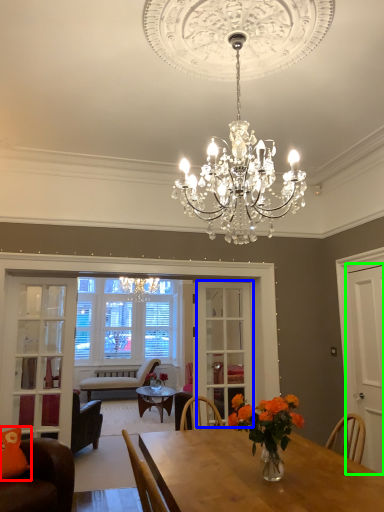
Question: Which is farther away from pillow (highlighted by a red box)? glass door (highlighted by a blue box) or door (highlighted by a green box)?

Choices:
 (A) glass door
 (B) door

Answer: (B)